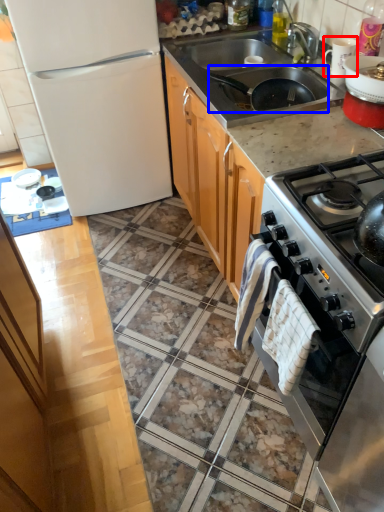
Question: Which object appears closest to the camera in this image, appliance (highlighted by a red box) or frying pan (highlighted by a blue box)?

Choices:
 (A) appliance
 (B) frying pan

Answer: (B)